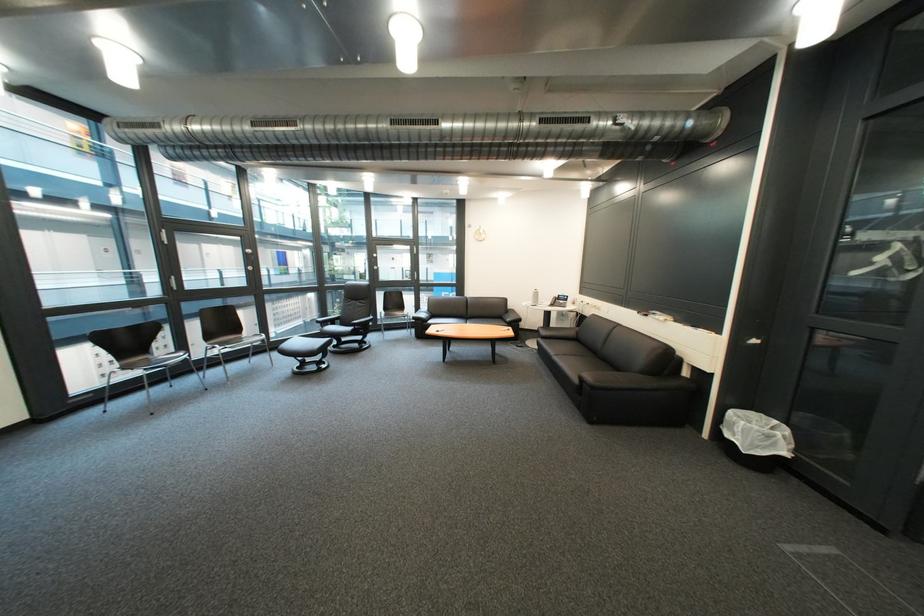
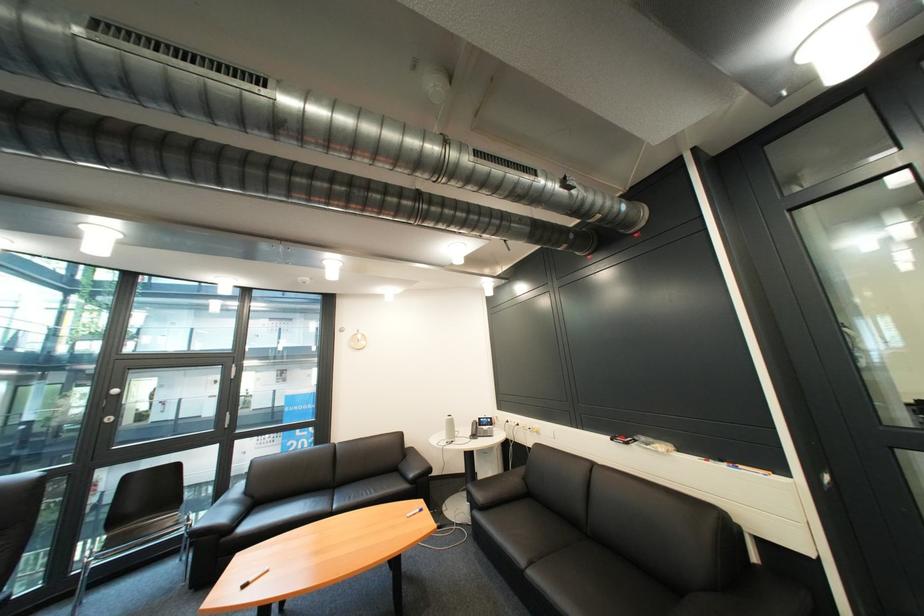
The point at (573, 297) is marked in the first image. Where is the corresponding point in the second image?

(492, 419)